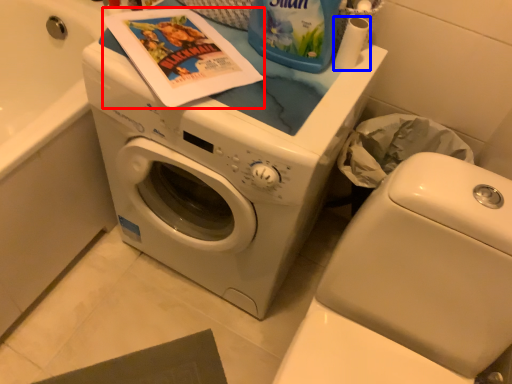
Question: Which object is further to the camera taking this photo, comic book (highlighted by a red box) or toilet paper (highlighted by a blue box)?

Choices:
 (A) comic book
 (B) toilet paper

Answer: (B)